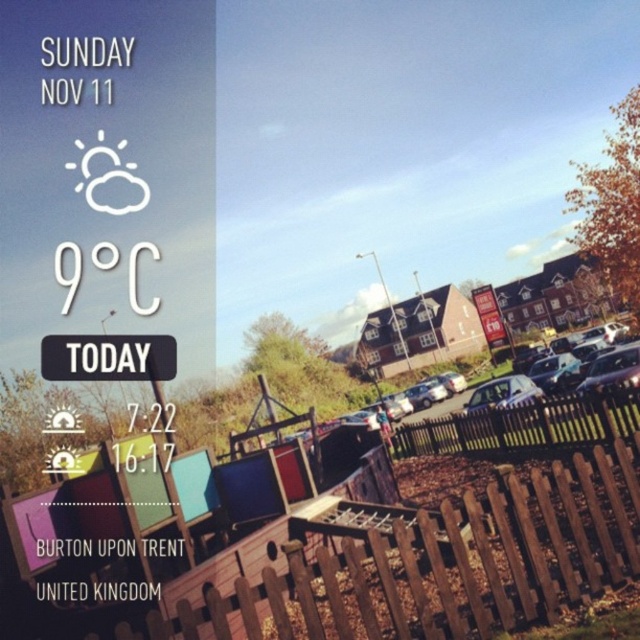
Does brown wooden fence at lower right appear on the right side of satin silver car at center?

Incorrect, brown wooden fence at lower right is not on the right side of satin silver car at center.

Between point (525, 497) and point (532, 381), which one is positioned behind?

The point (532, 381) is more distant.

Locate an element on the screen. This screenshot has width=640, height=640. brown wooden fence at lower right is located at coordinates (444, 564).

Can you confirm if brown wooden fence at lower right is taller than brown wooden fence at center?

No.

How distant is brown wooden fence at lower right from brown wooden fence at center?

The distance of brown wooden fence at lower right from brown wooden fence at center is 7.19 meters.

Who is more distant from viewer, (381, 580) or (572, 435)?

Positioned behind is point (572, 435).

Find the location of `brown wooden fence at lower right`. brown wooden fence at lower right is located at coordinates (444, 564).

Does black plastic sign at center appear on the right side of satin silver car at center?

In fact, black plastic sign at center is to the left of satin silver car at center.

From the picture: Who is positioned more to the left, black plastic sign at center or satin silver car at center?

black plastic sign at center is more to the left.

Who is more forward, (x=90, y=339) or (x=524, y=380)?

Positioned in front is point (x=90, y=339).

The height and width of the screenshot is (640, 640). Find the location of `black plastic sign at center`. black plastic sign at center is located at coordinates (108, 356).